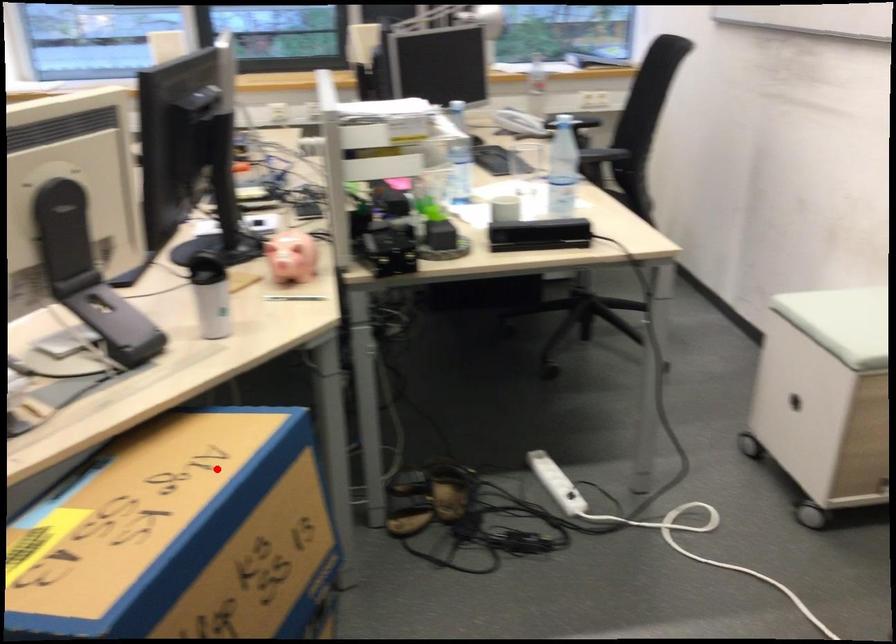
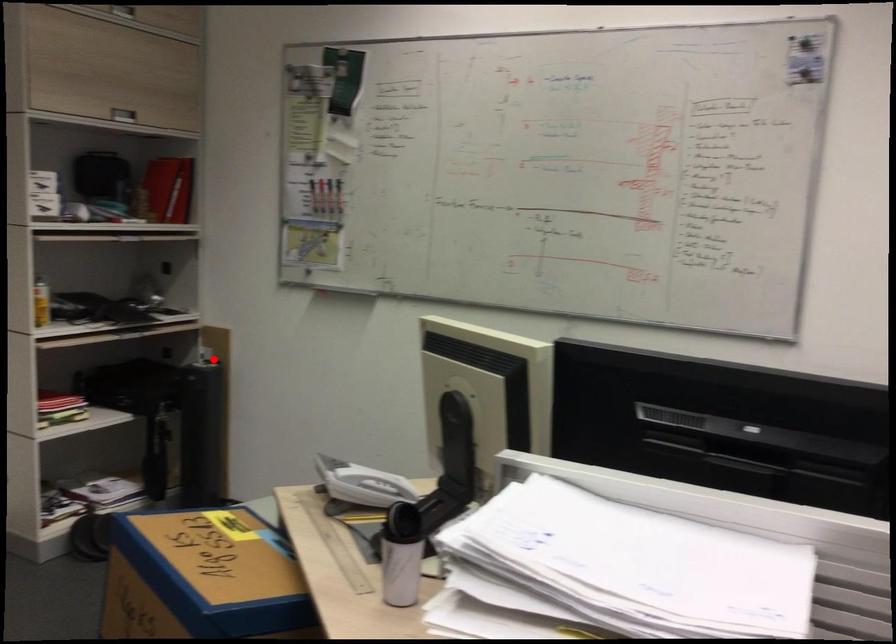
I am providing you with two images of the same scene from different viewpoints. A red point is marked on the first image and another point is marked on the second image. Are the points marked in image1 and image2 representing the same 3D position?

No